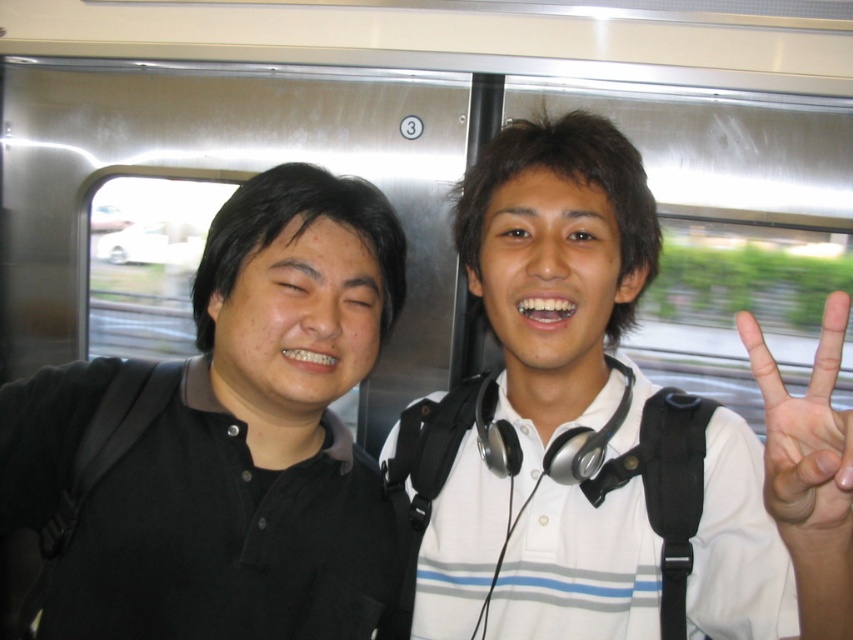
Can you confirm if black matte shirt at left is positioned to the right of white matte hand at center right?

In fact, black matte shirt at left is to the left of white matte hand at center right.

Is black matte shirt at left to the left of white matte hand at center right from the viewer's perspective?

Correct, you'll find black matte shirt at left to the left of white matte hand at center right.

Is point (317, 387) closer to camera compared to point (798, 515)?

No, it is behind (798, 515).

At what (x,y) coordinates should I click in order to perform the action: click on black matte shirt at left. Please return your answer as a coordinate pair (x, y). This screenshot has width=853, height=640. Looking at the image, I should click on (225, 438).

Which of these two, white matte shirt at center or white matte hand at center right, stands taller?

white matte shirt at center is taller.

Where is `white matte shirt at center`? white matte shirt at center is located at coordinates (607, 436).

Is point (817, 566) less distant than point (822, 316)?

No, it is behind (822, 316).

Find the location of `white matte shirt at center`. white matte shirt at center is located at coordinates (607, 436).

Which of these two, white matte shirt at center or black matte shirt at left, stands taller?

white matte shirt at center

Can you confirm if white matte shirt at center is positioned above black matte shirt at left?

Yes, white matte shirt at center is above black matte shirt at left.

Is point (515, 529) less distant than point (163, 460)?

No, it is not.

Image resolution: width=853 pixels, height=640 pixels. I want to click on white matte shirt at center, so click(607, 436).